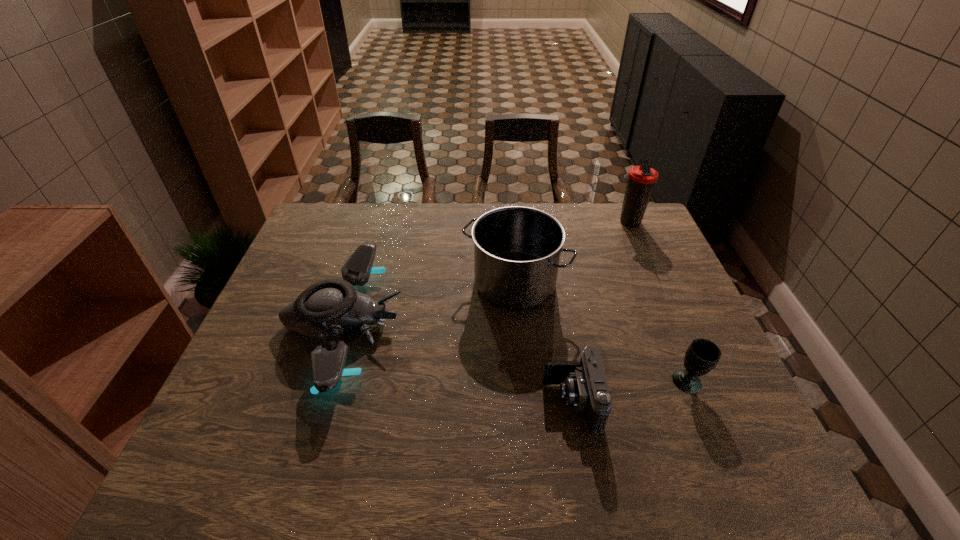
Image resolution: width=960 pixels, height=540 pixels. What are the coordinates of `free point located at the front of the camera with an open lens cover` in the screenshot? It's located at (522, 402).

This screenshot has height=540, width=960. Identify the location of vacant space located 0.380m at the front of the camera with an open lens cover. [377, 402].

Locate an element on the screen. This screenshot has width=960, height=540. vacant space situated on the front-facing side of the leftmost object is located at coordinates (522, 324).

Identify the location of object that is at the far edge. This screenshot has height=540, width=960. (641, 179).

You are a GUI agent. You are given a task and a screenshot of the screen. Output one action in this format:
    pyautogui.click(x=<x>, y=<y>)
    Task: Click on the object present at the left edge
    Image resolution: width=960 pixels, height=540 pixels.
    Given the screenshot: What is the action you would take?
    pyautogui.click(x=328, y=307)

The width and height of the screenshot is (960, 540). In order to click on thermos bottle positioned at the right edge in this screenshot , I will do `click(641, 179)`.

The height and width of the screenshot is (540, 960). What are the coordinates of `chalice that is at the right edge` in the screenshot? It's located at (702, 355).

What are the coordinates of `object situated at the far right corner` in the screenshot? It's located at (641, 179).

The width and height of the screenshot is (960, 540). In the image, there is a desktop. What are the coordinates of `free space at the far edge` in the screenshot? It's located at (451, 238).

Identify the location of free space at the near edge of the desktop. Image resolution: width=960 pixels, height=540 pixels. (276, 485).